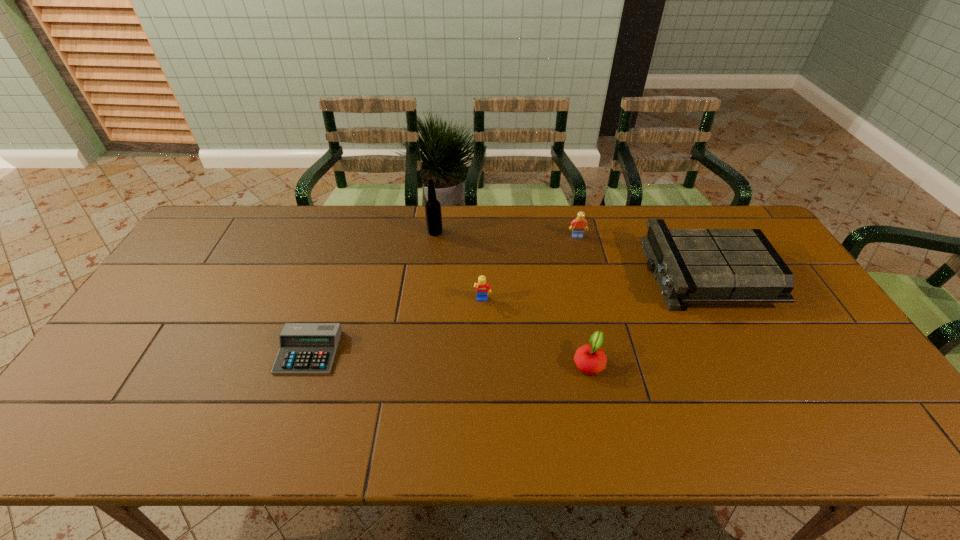
Find the location of a particular element. Image resolution: width=960 pixels, height=540 pixels. object that is at the right edge is located at coordinates (690, 265).

Where is `object located at the far right corner`? This screenshot has height=540, width=960. object located at the far right corner is located at coordinates (690, 265).

I want to click on vacant position at the far edge of the desktop, so click(x=364, y=242).

This screenshot has height=540, width=960. What are the coordinates of `vacant space at the near edge of the desktop` in the screenshot? It's located at (781, 424).

The width and height of the screenshot is (960, 540). I want to click on vacant space at the left edge of the desktop, so click(198, 252).

Locate an element on the screen. Image resolution: width=960 pixels, height=540 pixels. vacant region at the right edge of the desktop is located at coordinates (864, 379).

At what (x,y) coordinates should I click in order to perform the action: click on vacant area at the far left corner of the desktop. Please return your answer as a coordinate pair (x, y). Looking at the image, I should click on (227, 214).

This screenshot has height=540, width=960. In the image, there is a desktop. In order to click on vacant space at the far right corner in this screenshot , I will do `click(741, 211)`.

Locate an element on the screen. free space between the fifth tallest object and the rightmost object is located at coordinates (646, 318).

Where is `free space between the rightmost object and the right Lego`? The height and width of the screenshot is (540, 960). free space between the rightmost object and the right Lego is located at coordinates (641, 255).